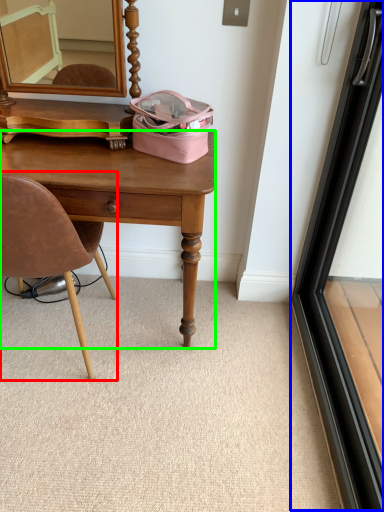
Question: Which is farther away from chair (highlighted by a red box)? screen door (highlighted by a blue box) or desk (highlighted by a green box)?

Choices:
 (A) screen door
 (B) desk

Answer: (A)